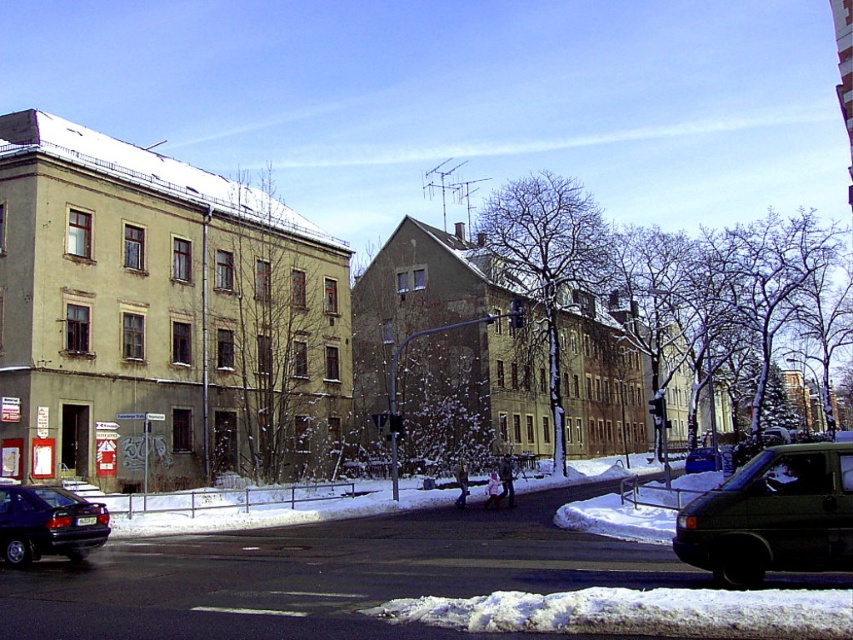
Is dark green matte van at lower right taller than dark green matte car at center?

Indeed, dark green matte van at lower right has a greater height compared to dark green matte car at center.

Consider the image. Can you confirm if dark green matte van at lower right is positioned to the right of dark green matte car at center?

Incorrect, dark green matte van at lower right is not on the right side of dark green matte car at center.

Does point (793, 477) come in front of point (706, 467)?

Yes, it is in front of point (706, 467).

I want to click on dark green matte van at lower right, so click(x=772, y=516).

Does white fluffy snow at lower center have a lesser height compared to dark green matte car at center?

Yes, white fluffy snow at lower center is shorter than dark green matte car at center.

Who is positioned more to the left, white fluffy snow at lower center or dark green matte car at center?

From the viewer's perspective, white fluffy snow at lower center appears more on the left side.

Is point (489, 604) more distant than point (698, 467)?

No, it is not.

I want to click on white fluffy snow at lower center, so click(637, 612).

Between shiny dark blue sedan at lower left and dark green matte car at center, which one is positioned lower?

dark green matte car at center

Can you confirm if shiny dark blue sedan at lower left is positioned above dark green matte car at center?

Indeed, shiny dark blue sedan at lower left is positioned over dark green matte car at center.

Does point (88, 525) come in front of point (698, 472)?

Yes, point (88, 525) is in front of point (698, 472).

The height and width of the screenshot is (640, 853). What are the coordinates of `shiny dark blue sedan at lower left` in the screenshot? It's located at (48, 524).